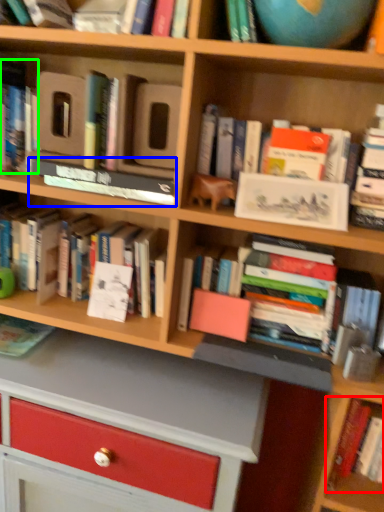
Question: Considering the real-world distances, which object is closest to book (highlighted by a red box)? book (highlighted by a blue box) or book (highlighted by a green box).

Choices:
 (A) book
 (B) book

Answer: (A)